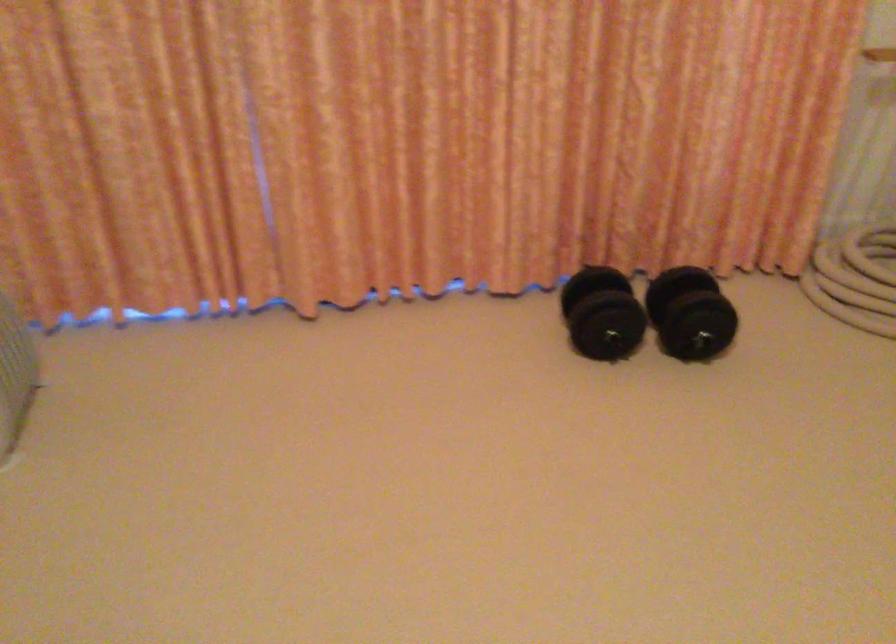
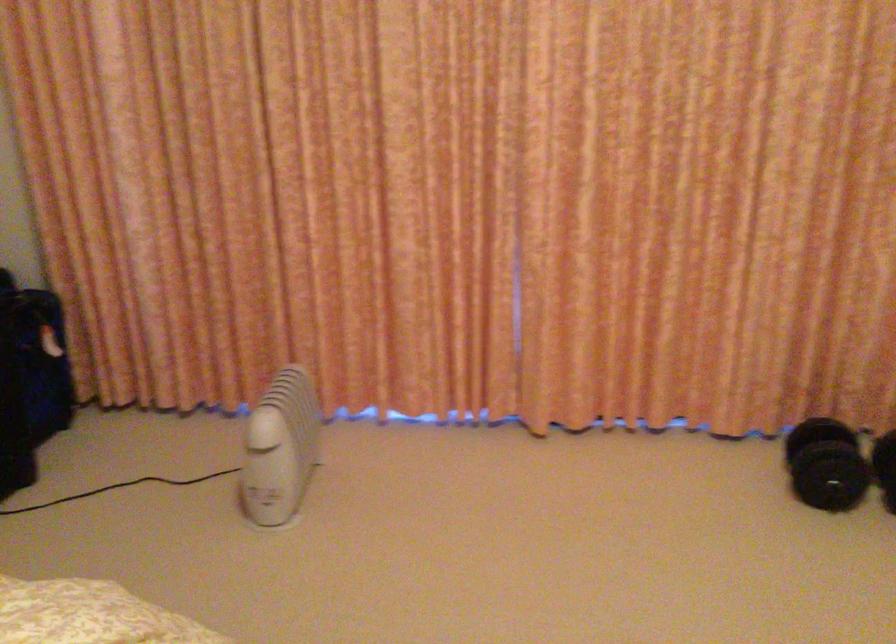
Question: The first image is from the beginning of the video and the second image is from the end. How did the camera likely rotate when shooting the video?

Choices:
 (A) Left
 (B) Right
 (C) Up
 (D) Down

Answer: (A)